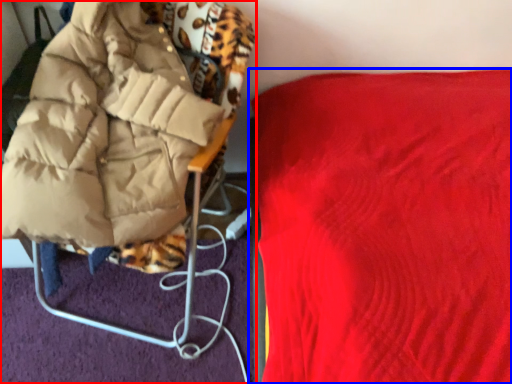
Question: Which point is further to the camera, furniture (highlighted by a red box) or furniture (highlighted by a blue box)?

Choices:
 (A) furniture
 (B) furniture

Answer: (A)